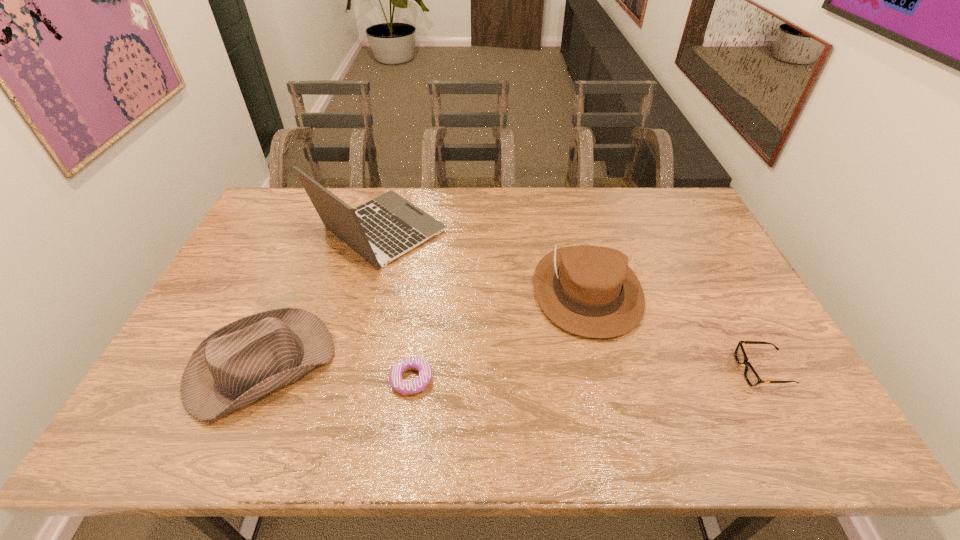
Locate an element on the screen. This screenshot has height=540, width=960. vacant area that lies between the tallest object and the doughnut is located at coordinates (396, 306).

You are a GUI agent. You are given a task and a screenshot of the screen. Output one action in this format:
    pyautogui.click(x=<x>, y=<y>)
    Task: Click on the free spot between the left fedora and the taller fedora
    The height and width of the screenshot is (540, 960).
    Given the screenshot: What is the action you would take?
    pyautogui.click(x=424, y=328)

Find the location of a particular element. The width and height of the screenshot is (960, 540). object that can be found as the second closest to the rightmost object is located at coordinates (405, 387).

Select which object is the third closest to the doughnut. Please provide its 2D coordinates. Your answer should be formatted as a tuple, i.e. [(x, y)], where the tuple contains the x and y coordinates of a point satisfying the conditions above.

[(389, 226)]

Locate an element on the screen. The height and width of the screenshot is (540, 960). free space that satisfies the following two spatial constraints: 1. at the front screen of the doughnut; 2. on the right side of the tallest object is located at coordinates (342, 380).

This screenshot has height=540, width=960. Identify the location of free location that satisfies the following two spatial constraints: 1. on the front side of the doughnut; 2. on the right side of the third tallest object. (255, 380).

Where is `vacant space that satisfies the following two spatial constraints: 1. at the front screen of the laptop_computer; 2. on the right side of the doughnut`? vacant space that satisfies the following two spatial constraints: 1. at the front screen of the laptop_computer; 2. on the right side of the doughnut is located at coordinates (342, 380).

Locate an element on the screen. blank area in the image that satisfies the following two spatial constraints: 1. at the front screen of the doughnut; 2. on the left side of the tallest object is located at coordinates (342, 380).